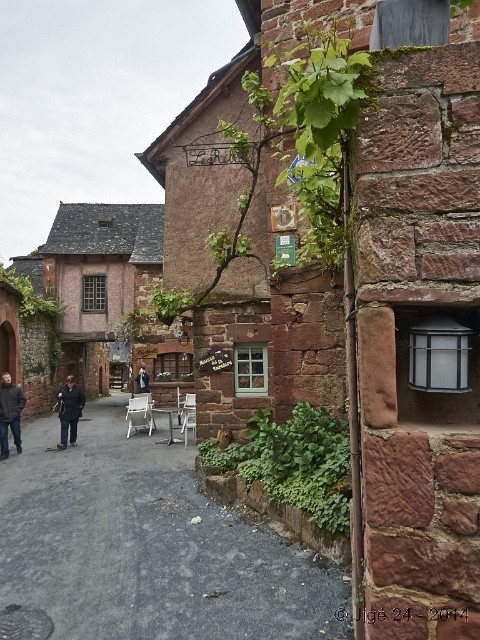
Question: Does dark gray jacket at lower left have a larger size compared to dark blue fabric jacket at center?

Choices:
 (A) yes
 (B) no

Answer: (B)

Question: Which is farther from the dark blue fabric jacket at center?

Choices:
 (A) dark gray fabric jacket at center
 (B) smooth stone alley at center
 (C) dark gray jacket at lower left

Answer: (A)

Question: Which point is closer to the camera taking this photo?

Choices:
 (A) (81, 394)
 (B) (10, 422)
 (C) (142, 387)
 (D) (10, 465)

Answer: (D)

Question: Is smooth stone alley at center smaller than dark gray fabric jacket at center?

Choices:
 (A) no
 (B) yes

Answer: (A)

Question: Is dark gray jacket at lower left thinner than dark blue fabric jacket at center?

Choices:
 (A) no
 (B) yes

Answer: (B)

Question: Which point is closer to the camera?

Choices:
 (A) dark blue fabric jacket at center
 (B) dark gray jacket at lower left

Answer: (B)